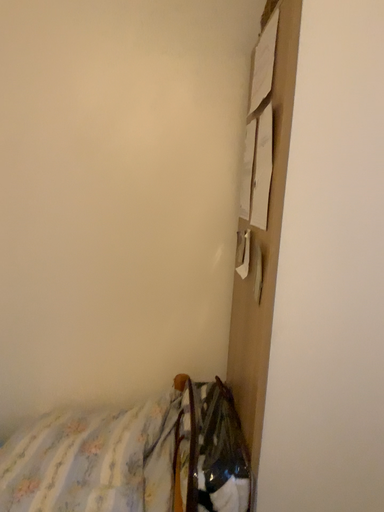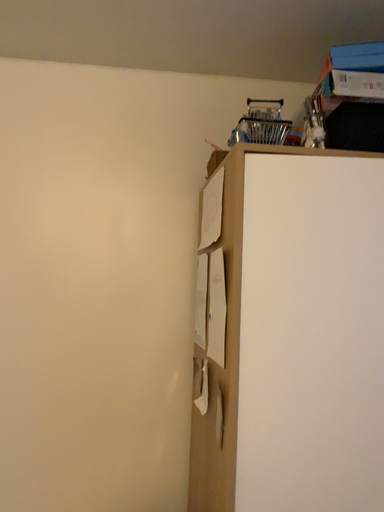
Question: How did the camera likely rotate when shooting the video?

Choices:
 (A) rotated left
 (B) rotated right

Answer: (B)